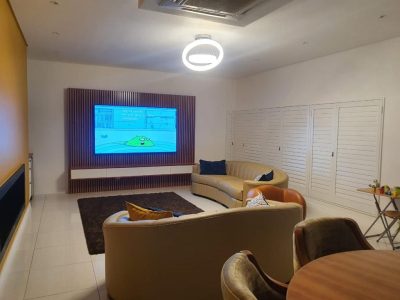
Locate an element on the screen. The height and width of the screenshot is (300, 400). light is located at coordinates (201, 56).